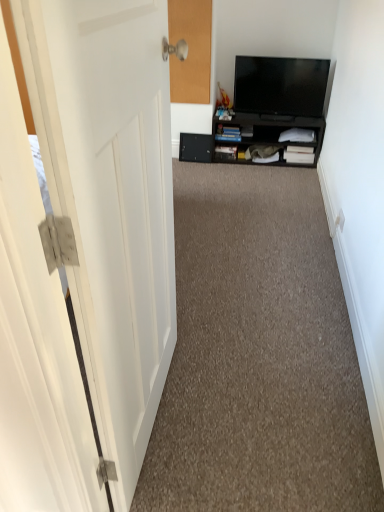
You are a GUI agent. You are given a task and a screenshot of the screen. Output one action in this format:
    pyautogui.click(x=<x>, y=<y>)
    Task: Click on the black glossy tv at upper right
    The image size is (384, 512).
    Given the screenshot: What is the action you would take?
    (280, 86)

This screenshot has height=512, width=384. Describe the element at coordinates (264, 134) in the screenshot. I see `black matte cabinet at center` at that location.

What do you see at coordinates (258, 356) in the screenshot?
I see `carpet at center` at bounding box center [258, 356].

The width and height of the screenshot is (384, 512). What are the coordinates of `carpet at center` in the screenshot? It's located at (258, 356).

Find the location of a particular element. This screenshot has height=512, width=384. black glossy tv at upper right is located at coordinates click(280, 86).

Between carpet at center and black matte drawer at center, which one has larger size?

With larger size is carpet at center.

Is carpet at center oriented towards black matte drawer at center?

No, carpet at center is not oriented towards black matte drawer at center.

Can you confirm if carpet at center is thinner than black matte drawer at center?

No, carpet at center is not thinner than black matte drawer at center.

From the image's perspective, which is above, black matte drawer at center or black matte cabinet at center?

black matte cabinet at center.

Considering the sizes of objects black matte drawer at center and black matte cabinet at center in the image provided, who is wider, black matte drawer at center or black matte cabinet at center?

black matte cabinet at center is wider.

Who is bigger, black matte drawer at center or black matte cabinet at center?

Bigger between the two is black matte cabinet at center.

Consider the image. In terms of size, does black glossy tv at upper right appear bigger or smaller than carpet at center?

In the image, black glossy tv at upper right appears to be smaller than carpet at center.

This screenshot has width=384, height=512. What are the coordinates of `corridor on the left of black glossy tv at upper right` in the screenshot? It's located at (258, 356).

Is point (240, 56) closer to camera compared to point (243, 505)?

No, it is not.

From the image's perspective, which is above, carpet at center or black matte cabinet at center?

black matte cabinet at center appears higher in the image.

Which object is more forward, carpet at center or black matte cabinet at center?

carpet at center is more forward.

Is black glossy tv at upper right shorter than black matte drawer at center?

No.

Is black glossy tv at upper right oriented towards black matte drawer at center?

No, black glossy tv at upper right is not oriented towards black matte drawer at center.

Locate an element on the screen. drawer on the left side of black glossy tv at upper right is located at coordinates (195, 147).

Does black matte cabinet at center have a lesser height compared to black matte drawer at center?

In fact, black matte cabinet at center may be taller than black matte drawer at center.

What's the angular difference between black matte cabinet at center and black matte drawer at center's facing directions?

There is a 0.906-degree angle between the facing directions of black matte cabinet at center and black matte drawer at center.

How far apart are black matte cabinet at center and black matte drawer at center?

black matte cabinet at center is 37.86 centimeters away from black matte drawer at center.

Is black matte cabinet at center positioned in front of black matte drawer at center?

Yes, black matte cabinet at center is closer to the viewer.

Is black matte cabinet at center positioned behind carpet at center?

Yes, black matte cabinet at center is further from the camera.

Is black matte cabinet at center not inside carpet at center?

Yes, black matte cabinet at center is located beyond the bounds of carpet at center.

Does black matte cabinet at center appear on the right side of carpet at center?

Correct, you'll find black matte cabinet at center to the right of carpet at center.

Are black matte cabinet at center and carpet at center making contact?

black matte cabinet at center and carpet at center are clearly separated.

Image resolution: width=384 pixels, height=512 pixels. Identify the location of drawer above the carpet at center (from a real-world perspective). (195, 147).

The width and height of the screenshot is (384, 512). Find the location of `drawer that appears behind the black matte cabinet at center`. drawer that appears behind the black matte cabinet at center is located at coordinates (195, 147).

When comparing their distances from black matte drawer at center, does carpet at center or black glossy tv at upper right seem closer?

black glossy tv at upper right is closer to black matte drawer at center.

Estimate the real-world distances between objects in this image. Which object is further from black matte cabinet at center, black glossy tv at upper right or white matte door at left?

white matte door at left is further to black matte cabinet at center.

Estimate the real-world distances between objects in this image. Which object is closer to carpet at center, black matte cabinet at center or black glossy tv at upper right?

The object closer to carpet at center is black matte cabinet at center.

When comparing their distances from carpet at center, does black glossy tv at upper right or black matte cabinet at center seem closer?

The object closer to carpet at center is black matte cabinet at center.

Which object lies nearer to the anchor point carpet at center, black glossy tv at upper right or white matte door at left?

white matte door at left is closer to carpet at center.

Considering their positions, is carpet at center positioned closer to black matte cabinet at center than black glossy tv at upper right?

black glossy tv at upper right.

When comparing their distances from carpet at center, does white matte door at left or black matte drawer at center seem further?

The object further to carpet at center is black matte drawer at center.

From the image, which object appears to be nearer to white matte door at left, black matte drawer at center or black matte cabinet at center?

black matte cabinet at center is positioned closer to the anchor white matte door at left.

This screenshot has width=384, height=512. What are the coordinates of `television located between carpet at center and black matte drawer at center in the depth direction` in the screenshot? It's located at (280, 86).

Locate an element on the screen. The width and height of the screenshot is (384, 512). corridor between white matte door at left and black glossy tv at upper right in the front-back direction is located at coordinates (258, 356).

You are a GUI agent. You are given a task and a screenshot of the screen. Output one action in this format:
    pyautogui.click(x=<x>, y=<y>)
    Task: Click on the cabinetry between carpet at center and black matte drawer at center along the z-axis
    Image resolution: width=384 pixels, height=512 pixels.
    Given the screenshot: What is the action you would take?
    pyautogui.click(x=264, y=134)

Find the location of `television between carpet at center and black matte cabinet at center from front to back`. television between carpet at center and black matte cabinet at center from front to back is located at coordinates (280, 86).